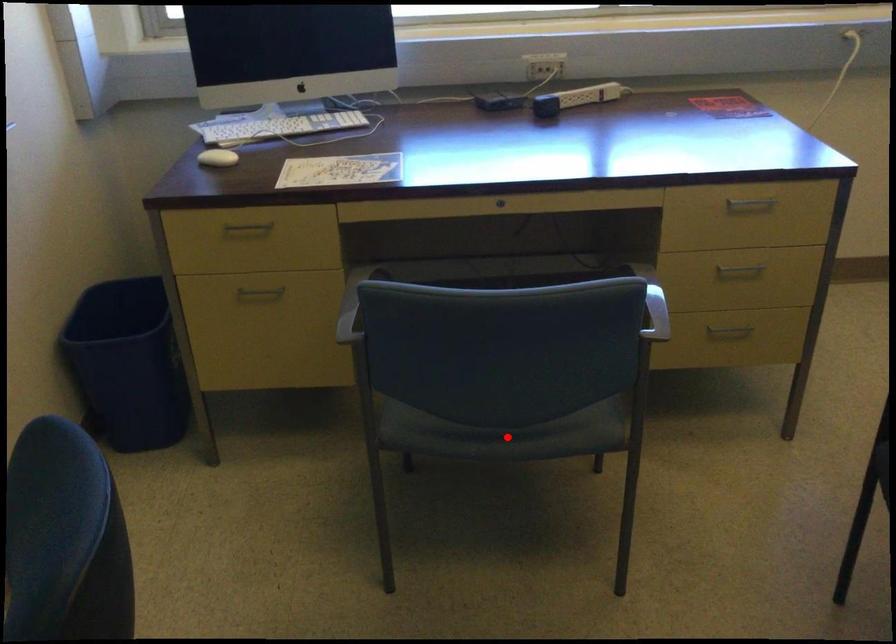
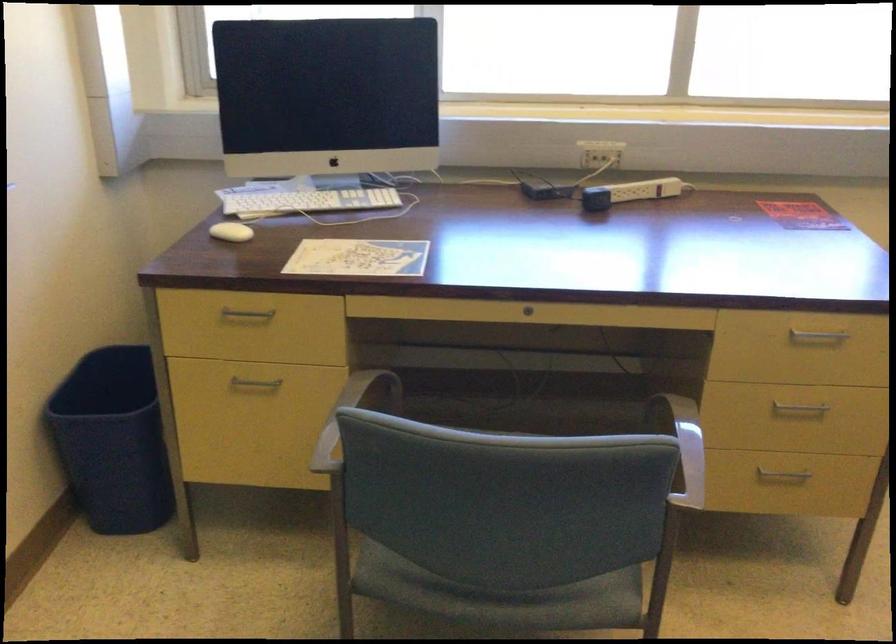
Find the pixel in the second image that matches the highlighted location in the first image.

(502, 597)